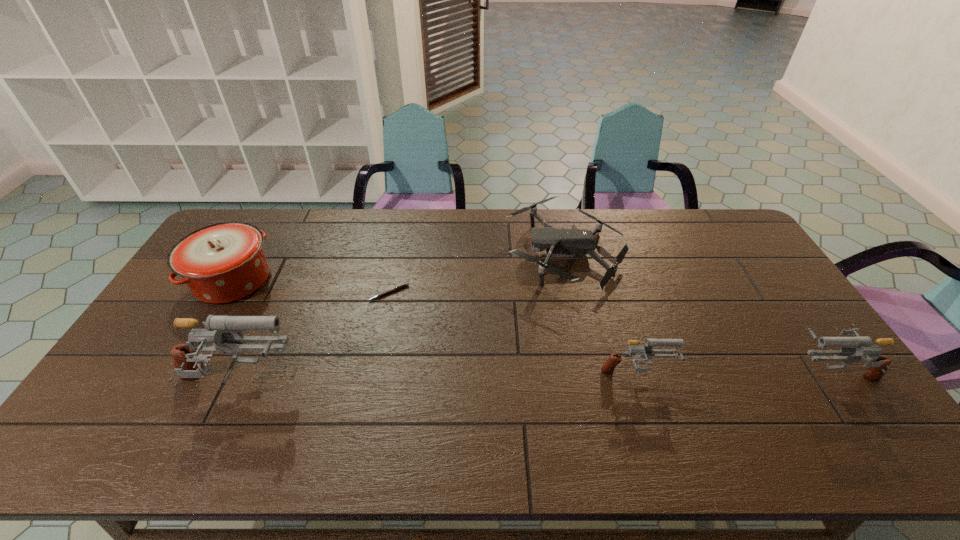
Locate an element on the screen. The height and width of the screenshot is (540, 960). the tallest object is located at coordinates (188, 365).

The height and width of the screenshot is (540, 960). In order to click on the tallest gun in this screenshot , I will do `click(188, 365)`.

Locate an element on the screen. the second gun from right to left is located at coordinates point(608,367).

The height and width of the screenshot is (540, 960). In order to click on the shortest gun in this screenshot , I will do `click(608, 367)`.

Locate an element on the screen. The width and height of the screenshot is (960, 540). the rightmost object is located at coordinates (878, 366).

Locate an element on the screen. the rightmost gun is located at coordinates 878,366.

Locate an element on the screen. The height and width of the screenshot is (540, 960). the fifth tallest object is located at coordinates (556, 241).

The image size is (960, 540). Identify the location of casserole. (225, 262).

Find the location of a particular element. Image resolution: width=960 pixels, height=540 pixels. pen is located at coordinates (406, 284).

At what (x,y) coordinates should I click in order to perform the action: click on the shortest object. Please return your answer as a coordinate pair (x, y). Looking at the image, I should click on (406, 284).